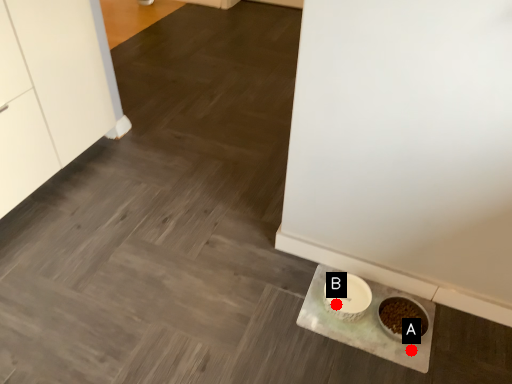
Question: Two points are circled on the image, labeled by A and B beside each circle. Which of the following is the farthest from the observer?

Choices:
 (A) A is further
 (B) B is further

Answer: (B)